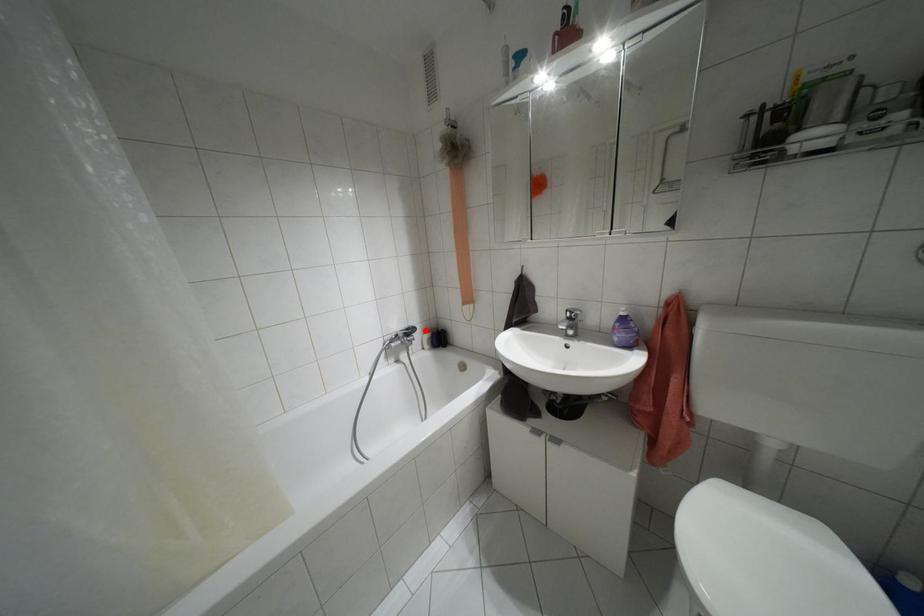
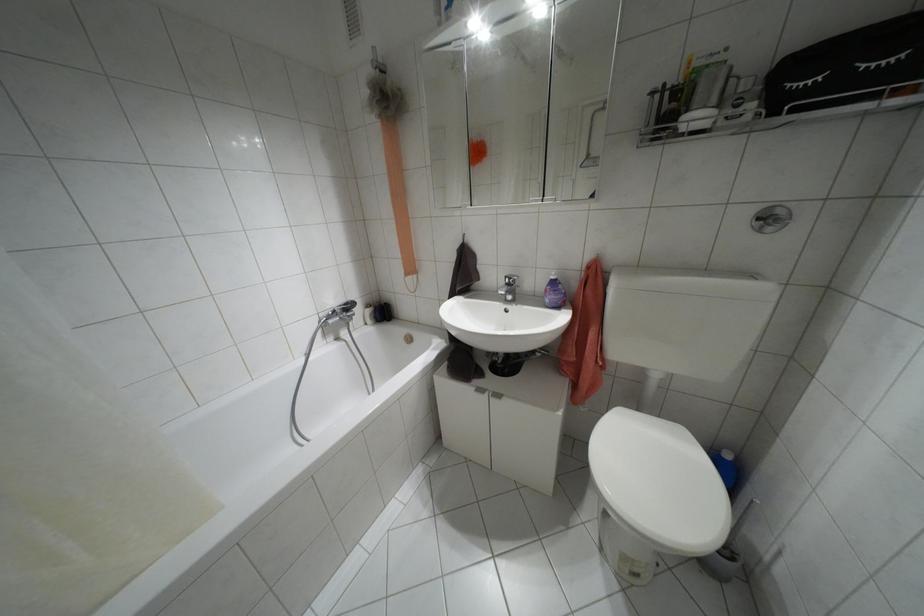
Find the pixel in the second image that matches the highlighted location in the first image.

(367, 305)